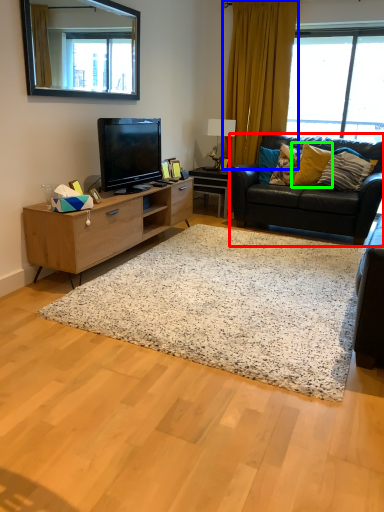
Question: Which is nearer to the studio couch (highlighted by a red box)? curtain (highlighted by a blue box) or pillow (highlighted by a green box).

Choices:
 (A) curtain
 (B) pillow

Answer: (B)